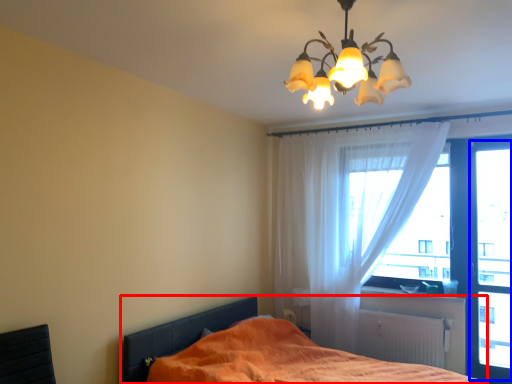
Question: Which point is further to the camera, bed (highlighted by a red box) or window screen (highlighted by a blue box)?

Choices:
 (A) bed
 (B) window screen

Answer: (B)